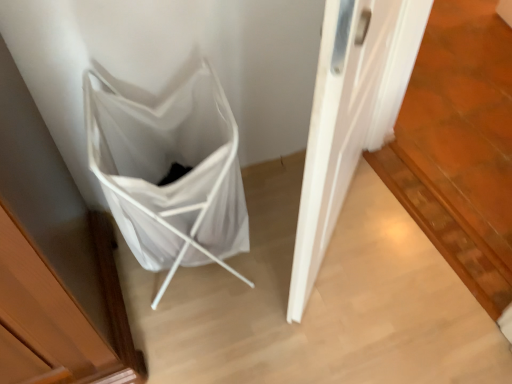
The width and height of the screenshot is (512, 384). In order to click on vacant space to the left of white matte door at center in this screenshot , I will do `click(249, 249)`.